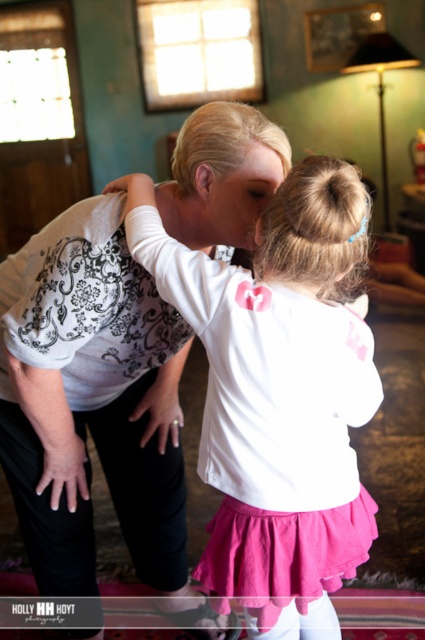
Looking at this image, who is positioned more to the right, white lace shirt at center or white matte shirt at center?

Positioned to the right is white matte shirt at center.

This screenshot has width=425, height=640. In order to click on white lace shirt at center in this screenshot , I will do `click(90, 401)`.

Where is `white lace shirt at center`? The image size is (425, 640). white lace shirt at center is located at coordinates (90, 401).